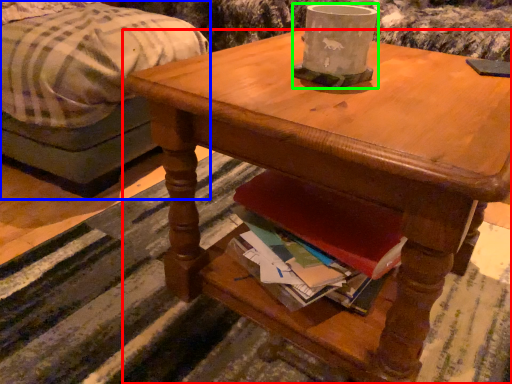
Question: Which is farther away from desk (highlighted by a red box)? studio couch (highlighted by a blue box) or coffee cup (highlighted by a green box)?

Choices:
 (A) studio couch
 (B) coffee cup

Answer: (A)